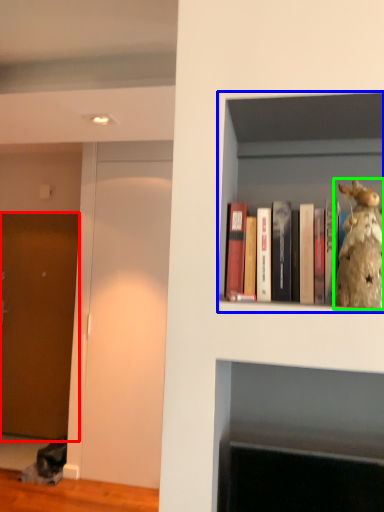
Question: Estimate the real-world distances between objects in this image. Which object is closer to door (highlighted by a red box), shelf (highlighted by a blue box) or figurine (highlighted by a green box)?

Choices:
 (A) shelf
 (B) figurine

Answer: (A)